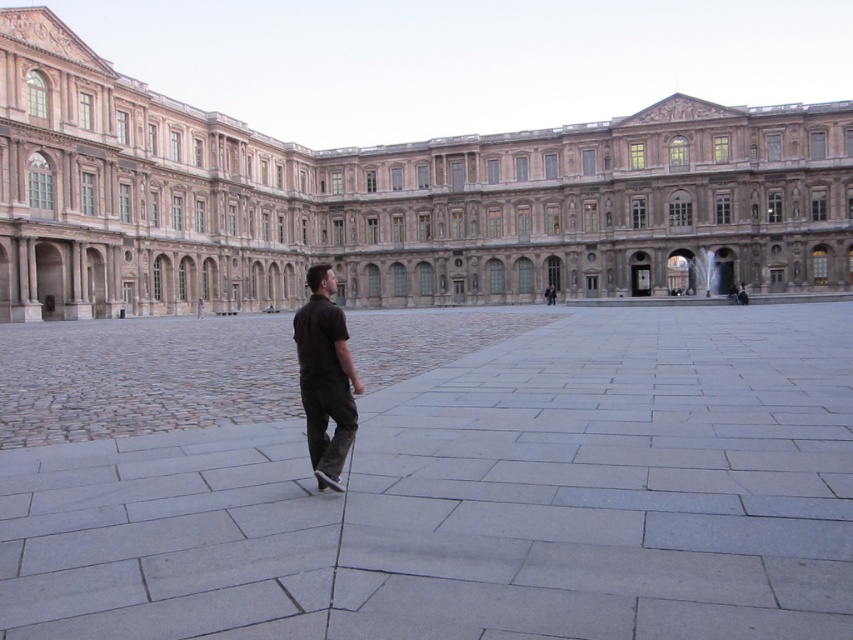
You are standing in the courtyard and want to take a photo of the beige stone palace at center. To ensure the palace is the main focus, where should you position yourself relative to the gray stone courtyard at center?

You should position yourself to the left side of the gray stone courtyard at center so that the beige stone palace at center is centered in your photo, as the gray stone courtyard at center is on the right side of the palace.

You are planning to host a large outdoor event in the courtyard. Given that the gray stone courtyard at center is narrower than the beige stone palace at center, which area would be more suitable for setting up a stage that requires a wider space?

The beige stone palace at center has a greater width than the gray stone courtyard at center, so the beige stone palace at center would be more suitable for setting up a stage that requires a wider space.